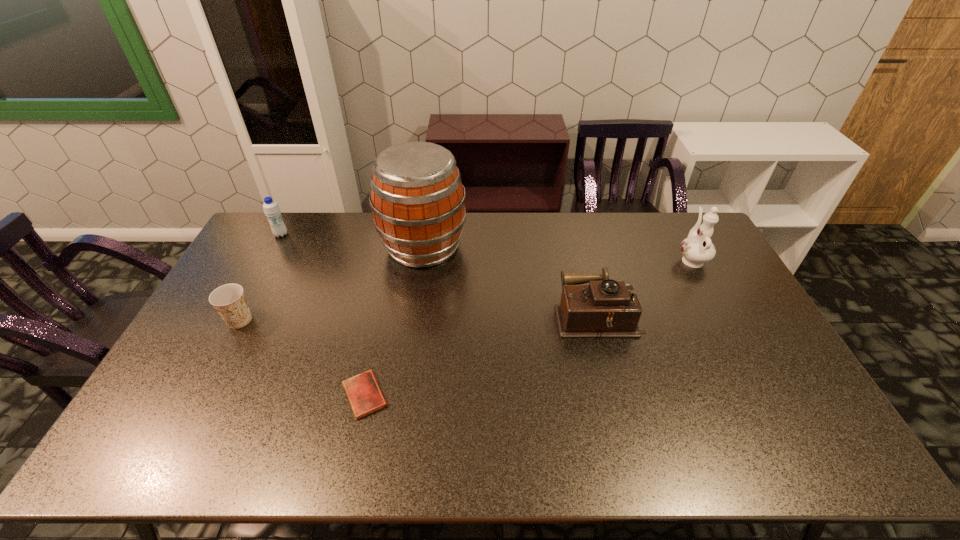
What are the coordinates of `water bottle located in the far edge section of the desktop` in the screenshot? It's located at (271, 209).

The image size is (960, 540). Find the location of `water bottle that is at the left edge`. water bottle that is at the left edge is located at coordinates (271, 209).

The width and height of the screenshot is (960, 540). Find the location of `Dixie cup that is at the left edge`. Dixie cup that is at the left edge is located at coordinates (229, 300).

Locate an element on the screen. Image resolution: width=960 pixels, height=540 pixels. object that is at the right edge is located at coordinates (697, 249).

In order to click on object that is at the far left corner in this screenshot , I will do `click(271, 209)`.

Identify the location of object present at the far right corner. (697, 249).

Identify the location of vacant space at the far edge of the desktop. (334, 249).

The width and height of the screenshot is (960, 540). I want to click on vacant space at the left edge, so click(x=241, y=260).

In the image, there is a desktop. In order to click on vacant space at the right edge in this screenshot , I will do `click(709, 268)`.

In order to click on free location at the near left corner of the desktop in this screenshot , I will do `click(176, 465)`.